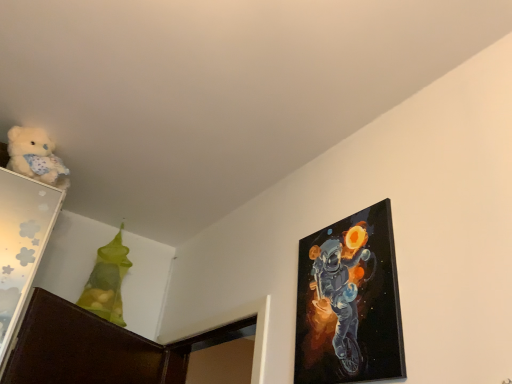
Question: Considering the relative positions of fluffy white teddy bear at upper left and translucent green bag at upper left in the image provided, is fluffy white teddy bear at upper left to the left of translucent green bag at upper left from the viewer's perspective?

Choices:
 (A) no
 (B) yes

Answer: (B)

Question: Is fluffy white teddy bear at upper left taller than translucent green bag at upper left?

Choices:
 (A) yes
 (B) no

Answer: (B)

Question: From the image's perspective, is fluffy white teddy bear at upper left located beneath translucent green bag at upper left?

Choices:
 (A) yes
 (B) no

Answer: (B)

Question: Is there a large distance between fluffy white teddy bear at upper left and translucent green bag at upper left?

Choices:
 (A) no
 (B) yes

Answer: (A)

Question: Considering the relative positions of fluffy white teddy bear at upper left and translucent green bag at upper left in the image provided, is fluffy white teddy bear at upper left to the right of translucent green bag at upper left from the viewer's perspective?

Choices:
 (A) no
 (B) yes

Answer: (A)

Question: From the image's perspective, is fluffy white teddy bear at upper left on translucent green bag at upper left?

Choices:
 (A) yes
 (B) no

Answer: (A)

Question: From the image's perspective, is translucent green bag at upper left beneath glossy canvas painting at upper right?

Choices:
 (A) yes
 (B) no

Answer: (A)

Question: Is translucent green bag at upper left behind glossy canvas painting at upper right?

Choices:
 (A) yes
 (B) no

Answer: (A)

Question: Considering the relative sizes of translucent green bag at upper left and glossy canvas painting at upper right in the image provided, is translucent green bag at upper left bigger than glossy canvas painting at upper right?

Choices:
 (A) no
 (B) yes

Answer: (B)

Question: Considering the relative sizes of translucent green bag at upper left and glossy canvas painting at upper right in the image provided, is translucent green bag at upper left shorter than glossy canvas painting at upper right?

Choices:
 (A) yes
 (B) no

Answer: (B)

Question: Would you say translucent green bag at upper left contains glossy canvas painting at upper right?

Choices:
 (A) no
 (B) yes

Answer: (A)

Question: Considering the relative positions of translucent green bag at upper left and glossy canvas painting at upper right in the image provided, is translucent green bag at upper left to the left of glossy canvas painting at upper right from the viewer's perspective?

Choices:
 (A) no
 (B) yes

Answer: (B)

Question: Is fluffy white teddy bear at upper left aimed at glossy canvas painting at upper right?

Choices:
 (A) no
 (B) yes

Answer: (A)